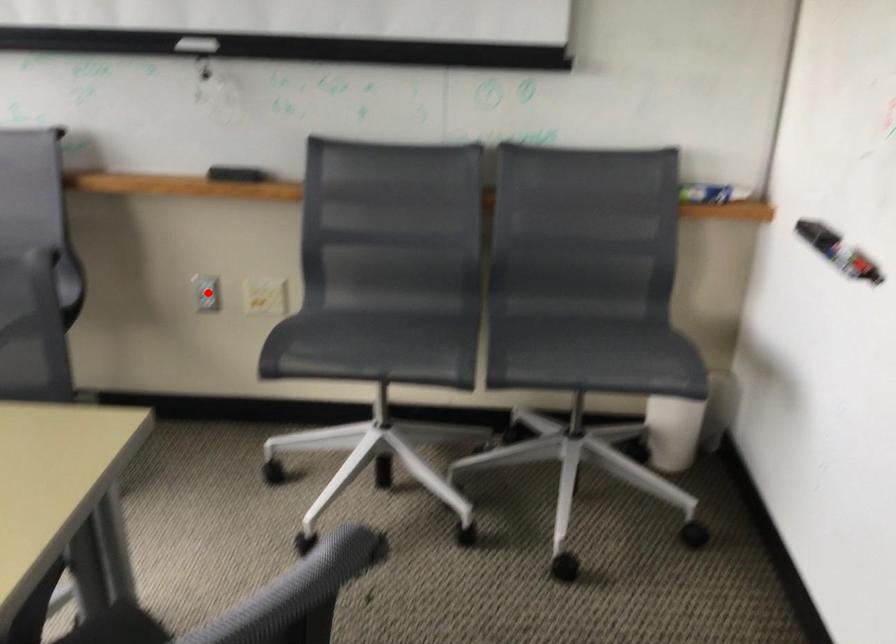
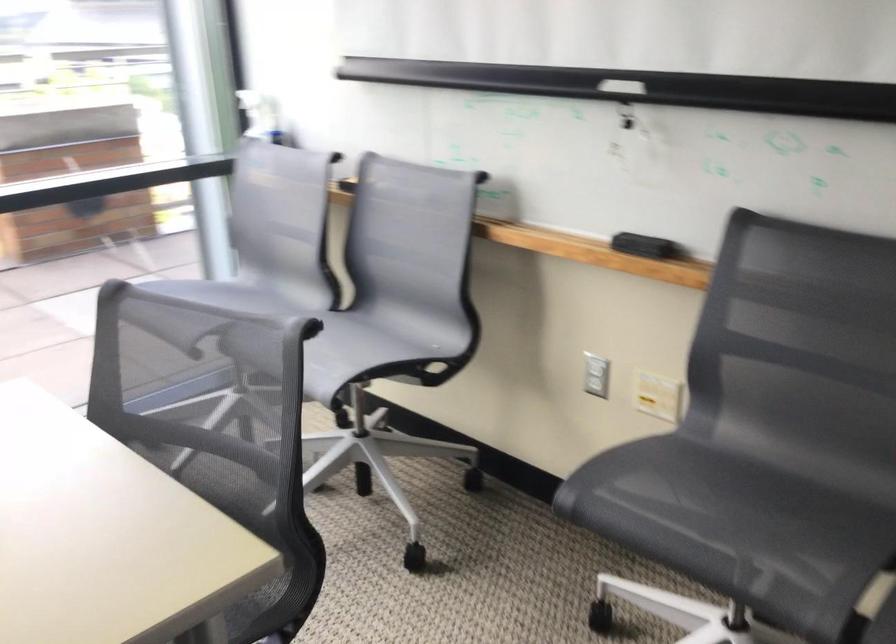
Question: A red point is marked in image1. In image2, is the corresponding 3D point closer to the camera or farther? Reply with the corresponding letter.

Choices:
 (A) The corresponding 3D point is closer.
 (B) The corresponding 3D point is farther.

Answer: (A)